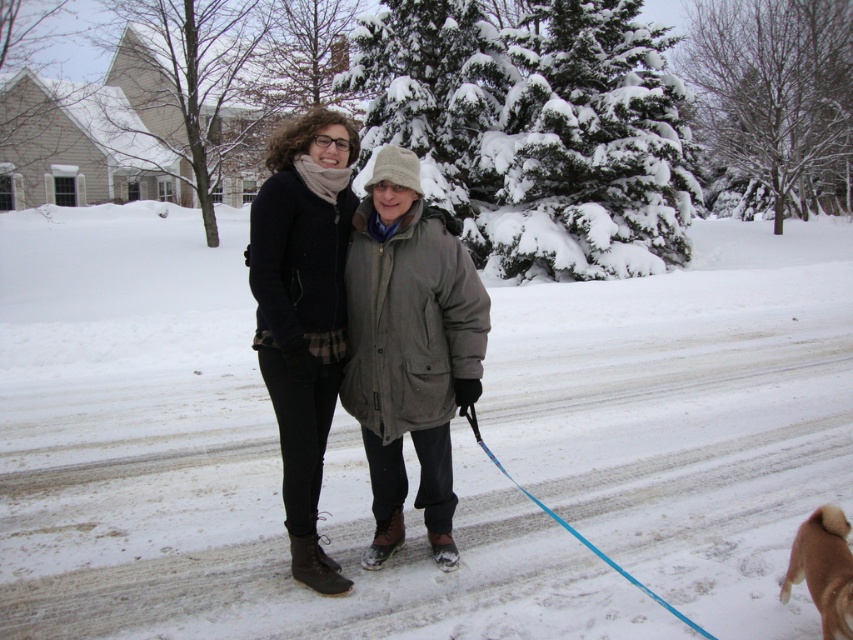
You are standing at the camera position and want to walk to point (x=265, y=216). How far will you have to walk?

The distance between point (x=265, y=216) and the camera is 3.35 meters, so you will have to walk 3.35 meters.

In the scene shown: You are a delivery person who needs to leave a package at the doorstep of the house closest to the matte black coat at center and brown furry dog at lower right. Which house should you approach?

The matte black coat at center is 6.04 feet away from brown furry dog at lower right. Since both objects are near each other, you should approach the house closest to either of them as they are in proximity.

You are standing at the point with coordinates point (840, 529) and want to walk towards the snow laden evergreen tree. Is the point point (270, 262) located behind you or in front of you relative to your direction of movement?

The point (270, 262) is behind point (840, 529), so if you are facing the snow laden evergreen tree and standing at point (840, 529), the point (270, 262) would be behind you.